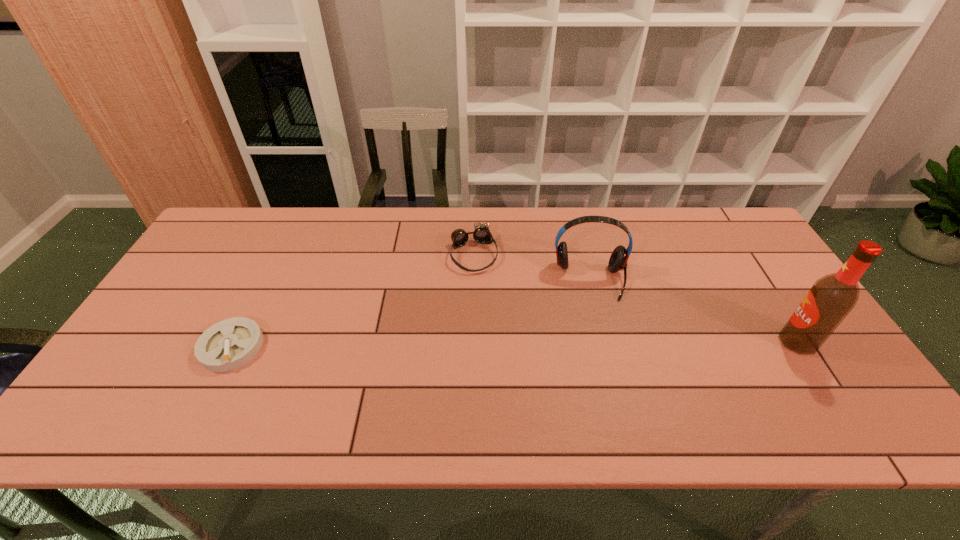
Locate an element on the screen. The image size is (960, 540). free spot that satisfies the following two spatial constraints: 1. on the front side of the second tallest object; 2. on the right side of the beer bottle is located at coordinates (606, 341).